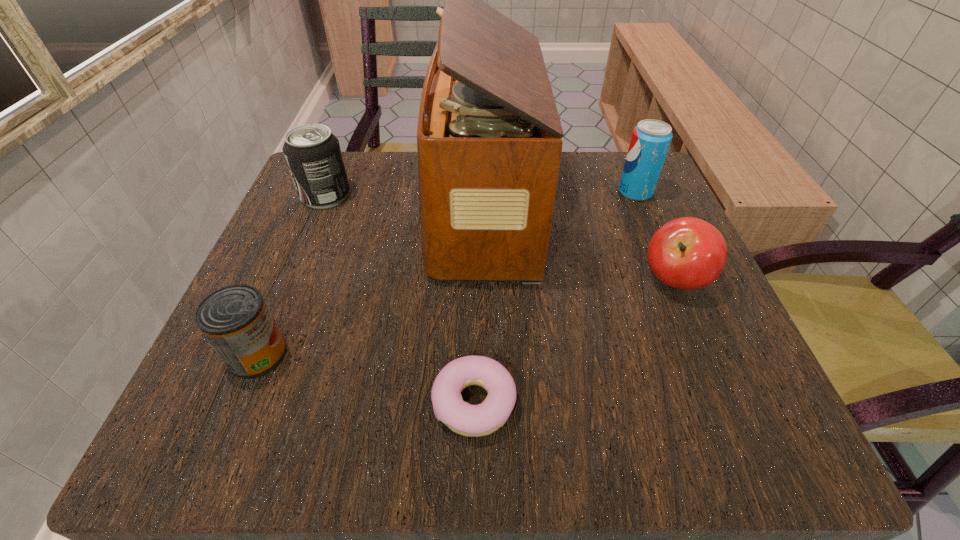
At what (x,y) coordinates should I click in order to perform the action: click on unoccupied position between the shortest object and the apple. Please return your answer as a coordinate pair (x, y). The height and width of the screenshot is (540, 960). Looking at the image, I should click on (574, 341).

The image size is (960, 540). I want to click on vacant region between the can and the apple, so click(467, 317).

I want to click on free space between the apple and the radio receiver, so click(x=578, y=246).

Where is `blank region between the shortest object and the can`? This screenshot has height=540, width=960. blank region between the shortest object and the can is located at coordinates (366, 379).

At what (x,y) coordinates should I click in order to perform the action: click on free area in between the radio receiver and the apple. Please return your answer as a coordinate pair (x, y). This screenshot has width=960, height=540. Looking at the image, I should click on (578, 246).

Where is `vacant space in between the doughnut and the apple`? The image size is (960, 540). vacant space in between the doughnut and the apple is located at coordinates (574, 341).

Image resolution: width=960 pixels, height=540 pixels. Find the location of `empty space that is in between the apple and the can`. empty space that is in between the apple and the can is located at coordinates (467, 317).

Where is `free spot between the can and the left soda can`? The height and width of the screenshot is (540, 960). free spot between the can and the left soda can is located at coordinates (292, 275).

Locate an element on the screen. vacant area that lies between the apple and the can is located at coordinates (467, 317).

Locate an element on the screen. Image resolution: width=960 pixels, height=540 pixels. the second closest object to the left soda can is located at coordinates (235, 319).